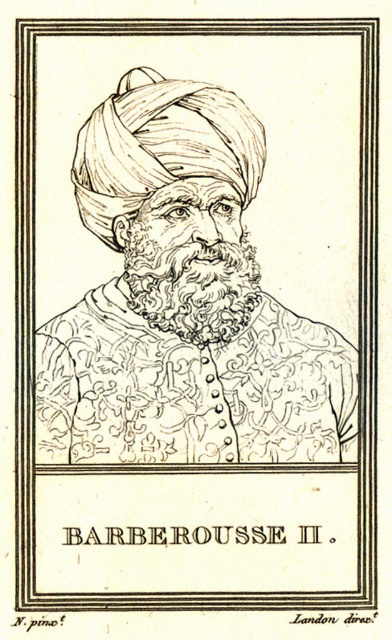
Question: Is black ink drawing of man at center wider than curly brown hair at center?

Choices:
 (A) yes
 (B) no

Answer: (A)

Question: Does black ink drawing of man at center appear on the left side of etched gold robe at center?

Choices:
 (A) yes
 (B) no

Answer: (A)

Question: Which object is positioned farthest from the black ink drawing of man at center?

Choices:
 (A) etched gold robe at center
 (B) curly brown hair at center

Answer: (B)

Question: Among these objects, which one is farthest from the camera?

Choices:
 (A) white textured turban at upper center
 (B) curly brown hair at center
 (C) etched gold robe at center

Answer: (B)

Question: Which point appears closest to the camera in this image?

Choices:
 (A) (103, 220)
 (B) (90, 420)

Answer: (A)

Question: Is etched gold robe at center wider than white textured turban at upper center?

Choices:
 (A) yes
 (B) no

Answer: (A)